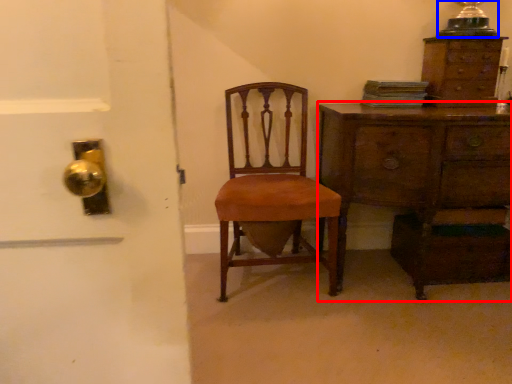
Question: Which object is closer to the camera taking this photo, chest of drawers (highlighted by a red box) or table lamp (highlighted by a blue box)?

Choices:
 (A) chest of drawers
 (B) table lamp

Answer: (A)